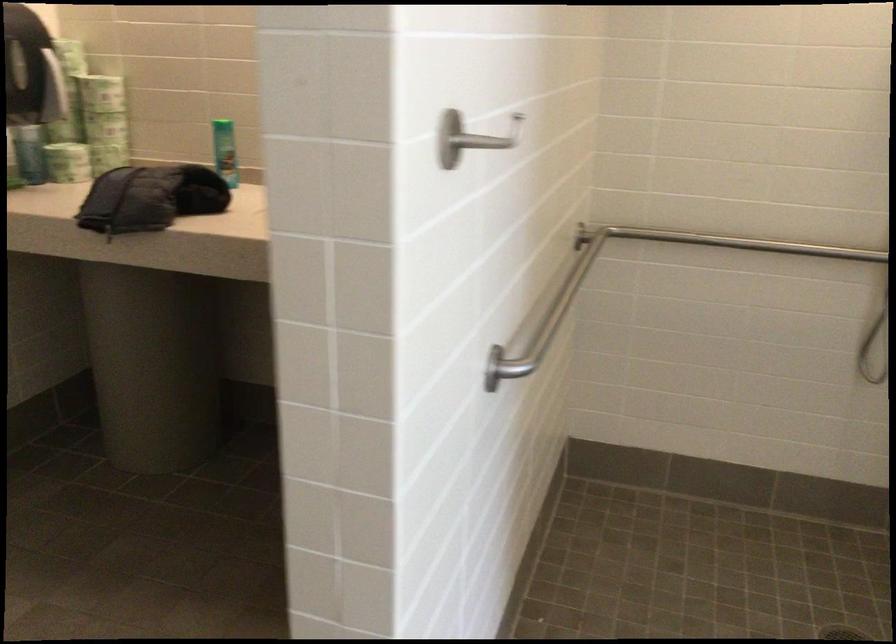
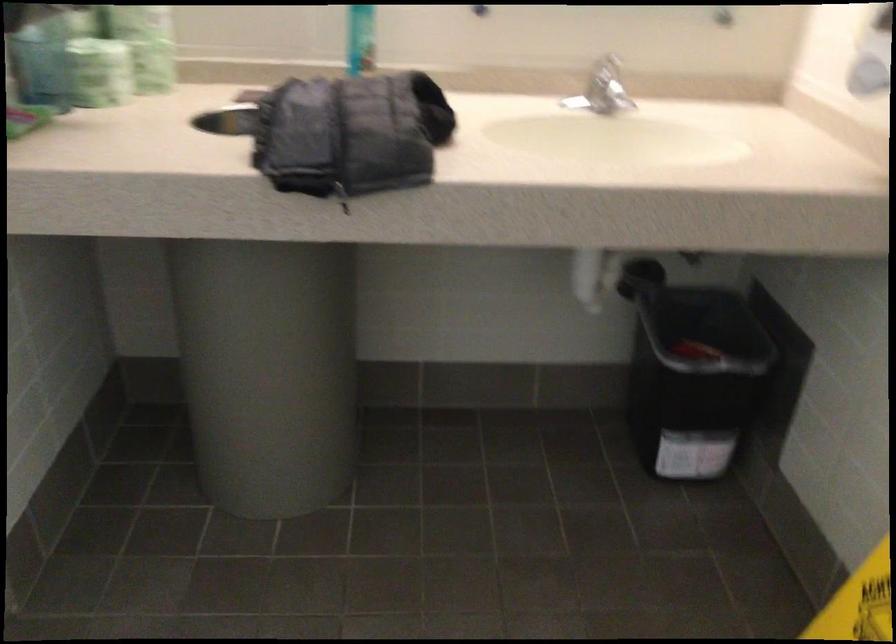
Find the pixel in the second image that matches point 124,232 in the first image.

(341, 196)